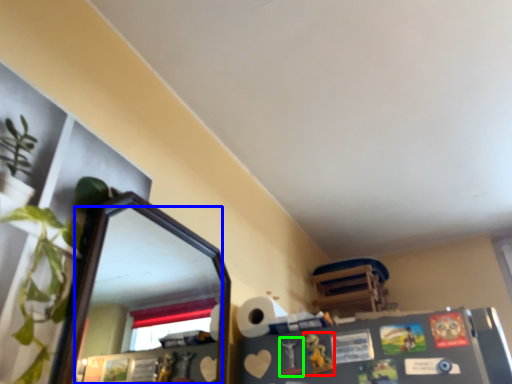
Question: Estimate the real-world distances between objects in this image. Which object is closer to toy (highlighted by a red box), mirror (highlighted by a blue box) or toy (highlighted by a green box)?

Choices:
 (A) mirror
 (B) toy

Answer: (B)